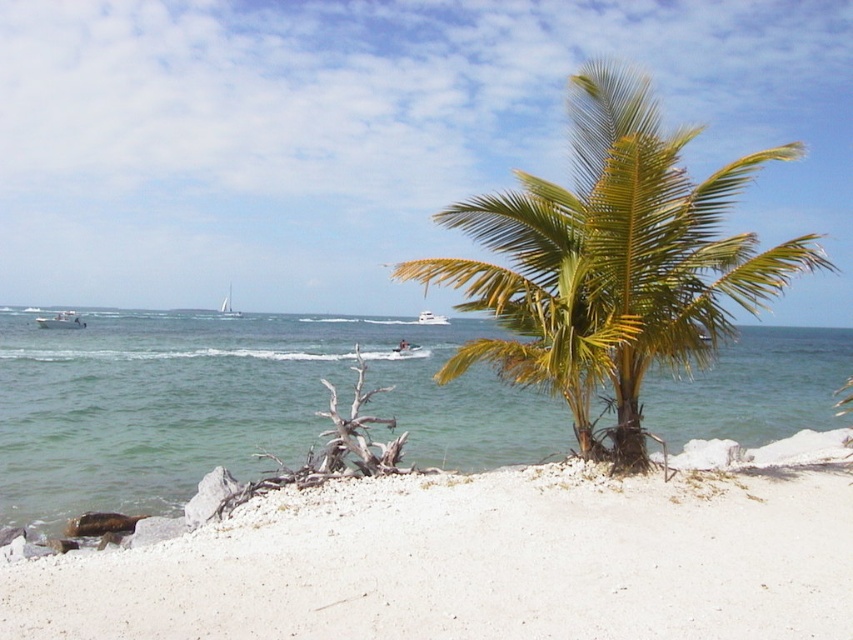
Looking at this image, you are a photographer standing on the beach and want to capture both the green leafy palm tree at center and the white glossy boat at center in a single wide shot. Considering the distance between them, do you think you can fit both into your camera frame without moving your position?

The distance between the green leafy palm tree at center and the white glossy boat at center is 71.67 meters. Since the photographer is stationary, capturing both in a single frame would depend on the camera lens. A wide angle lens could potentially include both, but standard lenses might require zooming out. However, without knowing the camera specifications, it is uncertain. The question might need more details about the equipment.

You are a photographer planning to take a photo of the white plastic boat at left in the beach scene. The boat is located at coordinates point 0.502, 0.073. If the camera frame is set to capture an area from point 0 to 0.5 on the horizontal axis and 0 to 0.1 on the vertical axis, will the boat be fully inside the frame?

The white plastic boat at left is positioned at point (61,321). Since the camera frame covers up to 0.5 on the horizontal axis and 0.1 on the vertical axis, the boat is slightly outside the frame on the horizontal axis but within the vertical limits. Therefore, the boat will not be fully inside the frame.